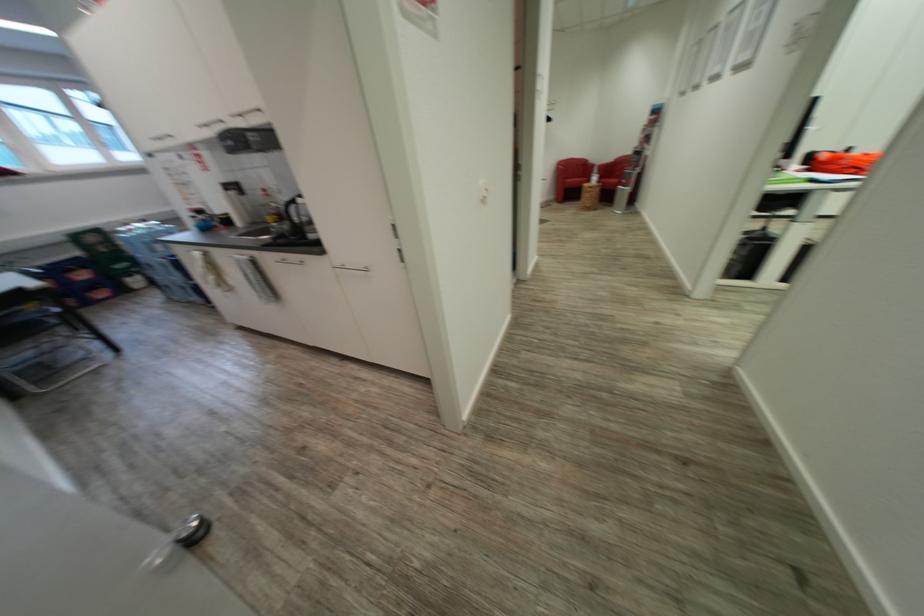
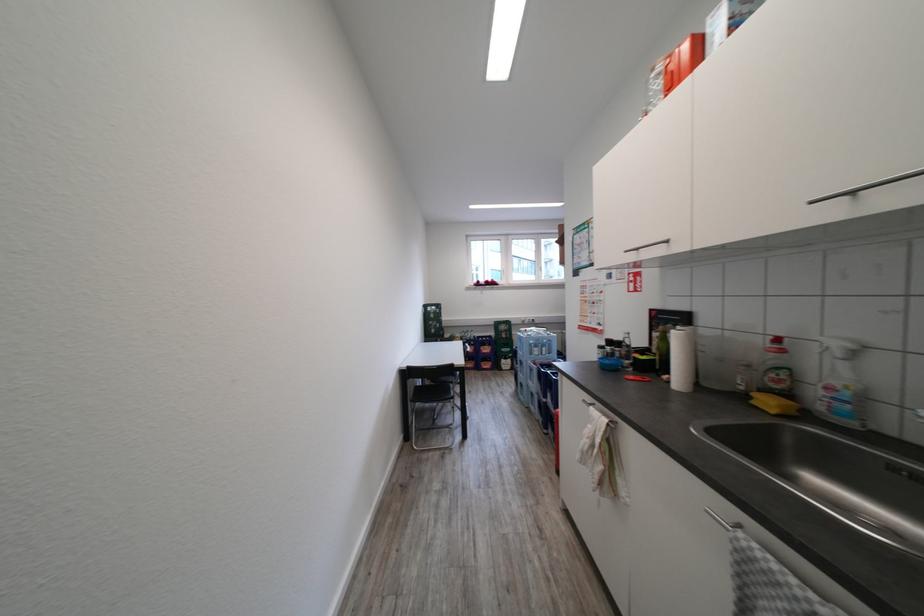
Locate, in the second image, the point that corresponds to (198,127) in the first image.

(811, 201)